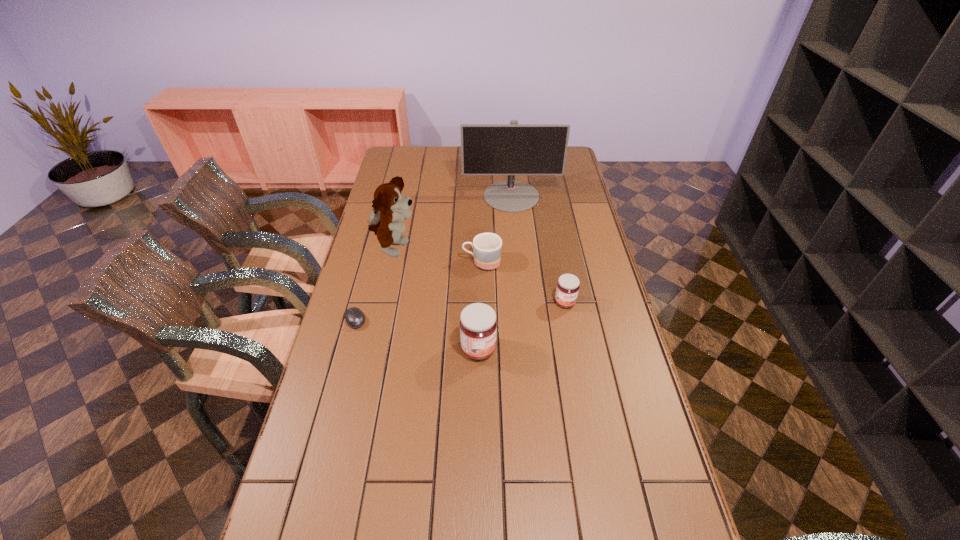
Where is `free space between the computer mouse and the computer monitor`? free space between the computer mouse and the computer monitor is located at coordinates (433, 258).

Locate an element on the screen. The height and width of the screenshot is (540, 960). free space that is in between the nearest object and the puppy is located at coordinates (436, 299).

This screenshot has width=960, height=540. I want to click on free area in between the shortest object and the left jam, so click(x=417, y=334).

Find the location of a particular element. The width and height of the screenshot is (960, 540). vacant area between the mug and the shortest object is located at coordinates (419, 291).

Where is `unoccupied area between the mug and the shorter jam`? unoccupied area between the mug and the shorter jam is located at coordinates (523, 282).

Find the location of `object that can be found as the second closest to the third tallest object`. object that can be found as the second closest to the third tallest object is located at coordinates (487, 247).

This screenshot has width=960, height=540. In order to click on object that can be found as the fourth closest to the taller jam in this screenshot , I will do `click(390, 207)`.

Identify the location of vacant area in the image that satisfies the following two spatial constraints: 1. on the screen of the farthest object; 2. on the right side of the right jam. (521, 302).

Identify the location of vacant position in the image that satisfies the following two spatial constraints: 1. on the face of the fourth shortest object; 2. on the left side of the puppy. (372, 349).